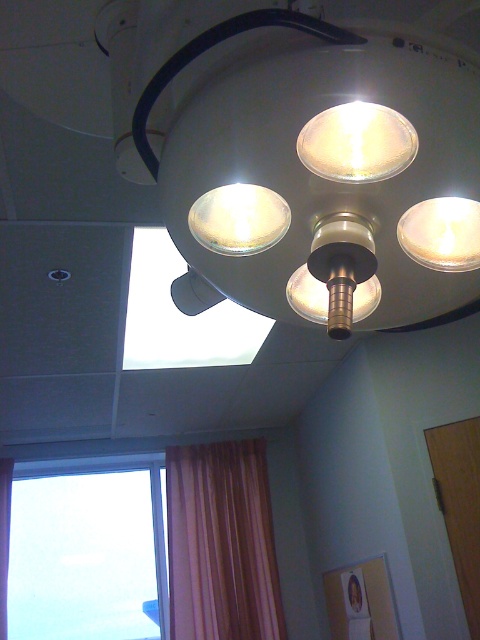
Between transparent glass window at lower left and orange fabric curtain at lower left, which one has more height?

With more height is orange fabric curtain at lower left.

Is point (144, 566) positioned behind point (210, 492)?

No.

The width and height of the screenshot is (480, 640). I want to click on transparent glass window at lower left, so click(88, 554).

This screenshot has height=640, width=480. What do you see at coordinates (357, 141) in the screenshot?
I see `matte white lamp at center` at bounding box center [357, 141].

Who is more distant from viewer, (x=338, y=140) or (x=0, y=593)?

Point (x=0, y=593)

Is point (367, 160) positioned before point (7, 556)?

Yes, it is in front of point (7, 556).

Locate an element on the screen. This screenshot has height=640, width=480. matte white lamp at center is located at coordinates (357, 141).

Is orange fabric curtain at lower left wider than matte gold lamp at upper center?

Yes.

Does point (184, 540) lie in front of point (447, 228)?

No, it is not.

The width and height of the screenshot is (480, 640). I want to click on orange fabric curtain at lower left, so click(222, 544).